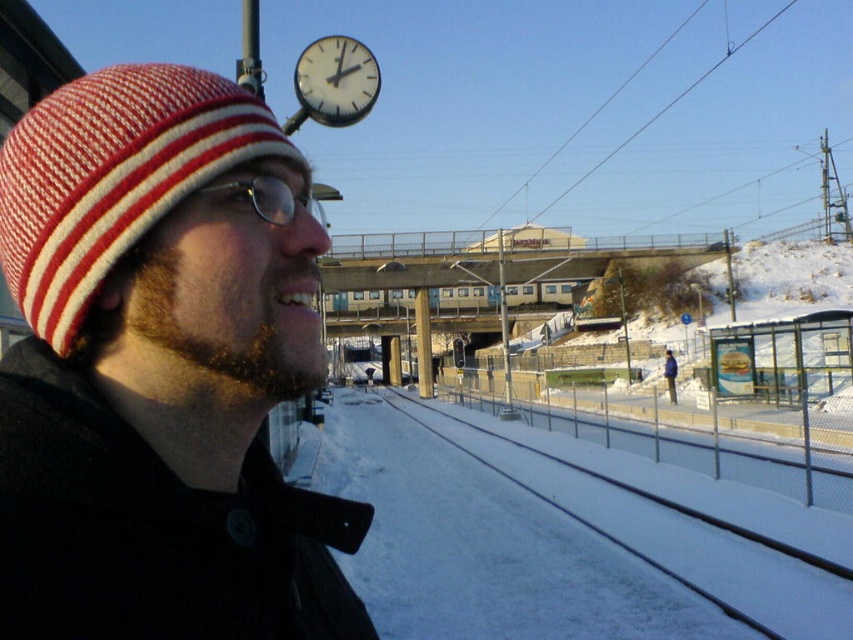
You are standing at the train station and looking at the person in the image. Which object is positioned to the right of the other between the white glossy clock at upper center and the clear plastic glasses at upper center?

The white glossy clock at upper center is positioned to the right of the clear plastic glasses at upper center.